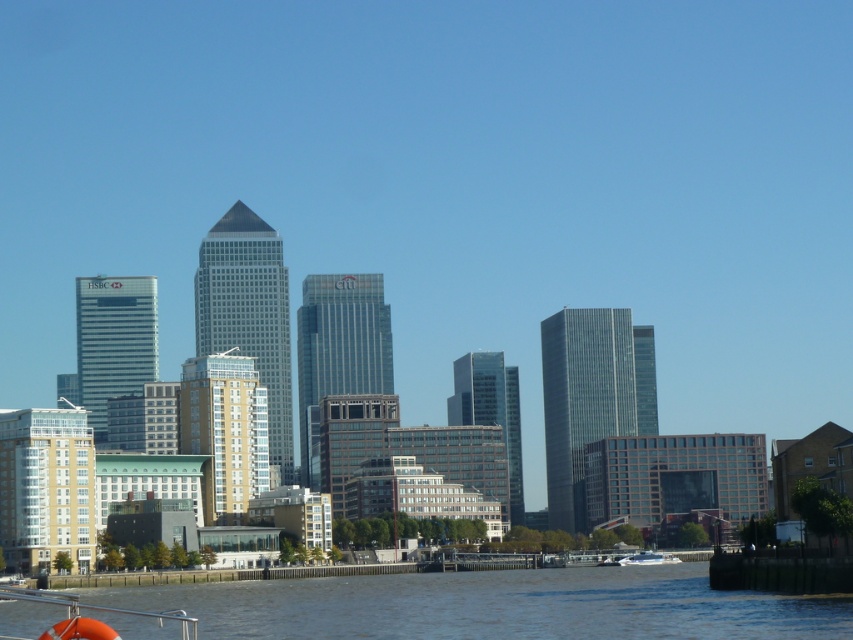
Question: Is brown water at lower center above white glossy boat at lower center?

Choices:
 (A) no
 (B) yes

Answer: (B)

Question: Is brown water at lower center behind white glossy boat at lower center?

Choices:
 (A) no
 (B) yes

Answer: (A)

Question: Which object is closer to the camera taking this photo?

Choices:
 (A) brown water at lower center
 (B) white glossy boat at lower center

Answer: (A)

Question: Which point is closer to the camera taking this photo?

Choices:
 (A) (498, 593)
 (B) (646, 563)

Answer: (A)

Question: Can you confirm if brown water at lower center is thinner than white glossy boat at lower center?

Choices:
 (A) yes
 (B) no

Answer: (B)

Question: Which point is farther to the camera?

Choices:
 (A) white glossy boat at lower center
 (B) brown water at lower center

Answer: (A)